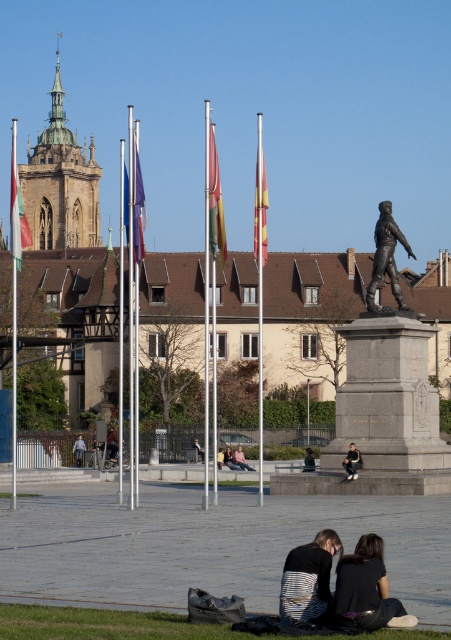
Question: Considering the real-world distances, which object is closest to the bronze statue at center right?

Choices:
 (A) purple fabric flag at center
 (B) yellow fabric flag at center
 (C) bronze statue at center

Answer: (C)

Question: Which object is farther from the camera taking this photo?

Choices:
 (A) polished silver flagpole at center
 (B) bronze statue at center right
 (C) green fabric flag at upper left
 (D) dark gray stone statue at center

Answer: (B)

Question: Does polished silver flagpole at center lie in front of dark gray stone statue at center?

Choices:
 (A) no
 (B) yes

Answer: (B)

Question: Which object is positioned closest to the bronze statue at center?

Choices:
 (A) green fabric flag at upper left
 (B) bronze statue at center right

Answer: (B)

Question: Does bronze statue at center come behind yellow fabric flag at center?

Choices:
 (A) yes
 (B) no

Answer: (A)

Question: Is bronze statue at center right smaller than dark gray stone statue at center?

Choices:
 (A) no
 (B) yes

Answer: (A)